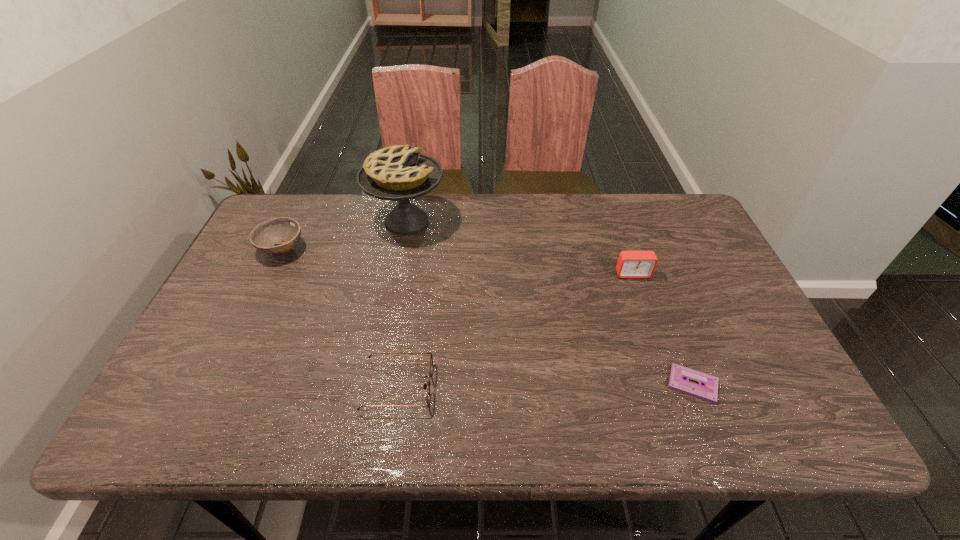
Where is `pie`? The height and width of the screenshot is (540, 960). pie is located at coordinates (399, 173).

Find the location of a particular element. alarm clock is located at coordinates (631, 264).

Identify the location of the leftmost object. This screenshot has height=540, width=960. (286, 231).

Image resolution: width=960 pixels, height=540 pixels. I want to click on sunglasses, so click(x=431, y=358).

Identify the location of videotape. The width and height of the screenshot is (960, 540). (708, 391).

Identify the location of free space located on the cut side of the tallest object. This screenshot has height=540, width=960. (568, 221).

Locate an element on the screen. The image size is (960, 540). free space located 0.390m on the front-facing side of the third nearest object is located at coordinates (680, 409).

At what (x,y) coordinates should I click in order to perform the action: click on vacant area situated 0.210m on the front of the bowl. Please return your answer as a coordinate pair (x, y). Looking at the image, I should click on (247, 323).

You are a GUI agent. You are given a task and a screenshot of the screen. Output one action in this format:
    pyautogui.click(x=<x>, y=<y>)
    Task: Click on the vacant region located on the front-facing side of the sunglasses
    This screenshot has height=540, width=960.
    Given the screenshot: What is the action you would take?
    pyautogui.click(x=602, y=386)

What are the coordinates of `blank space located 0.320m on the back of the shortest object` in the screenshot? It's located at (648, 269).